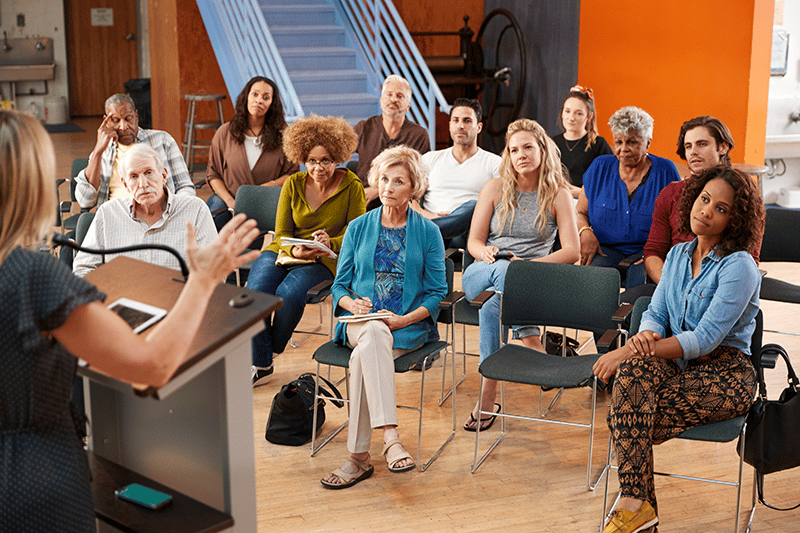
This screenshot has width=800, height=533. I want to click on men sitting in chairs, so click(158, 184), click(116, 124), click(389, 127), click(457, 172), click(708, 144).